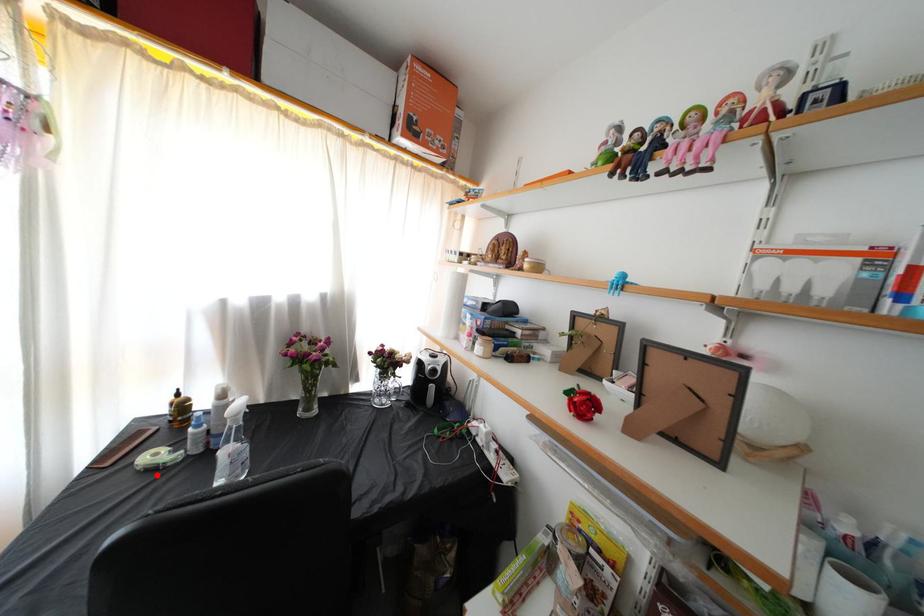
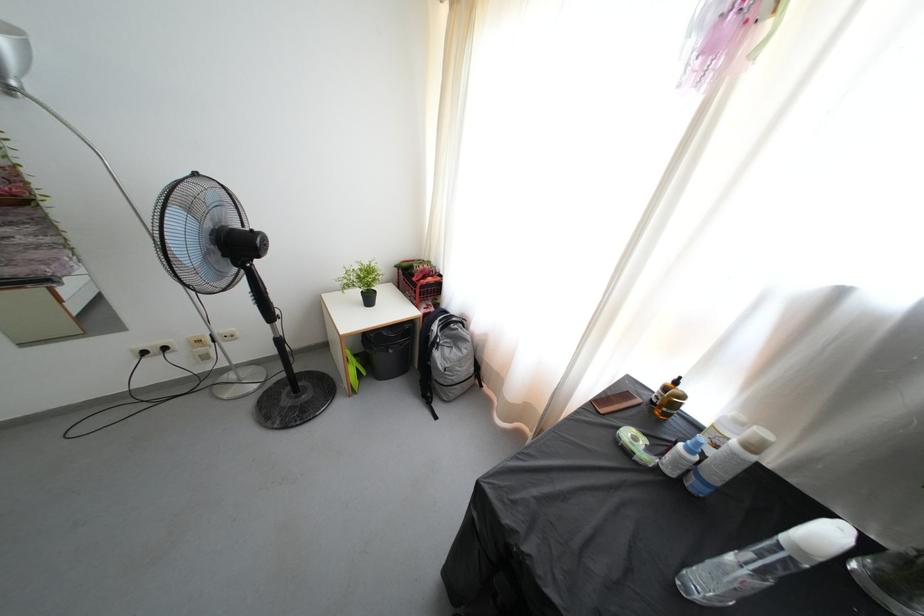
Question: I am providing you with two images of the same scene from different viewpoints. Image1 has a red point marked. In image2, the corresponding 3D location appears at what relative position? Reply with the corresponding letter.

Choices:
 (A) Closer
 (B) Farther

Answer: (B)